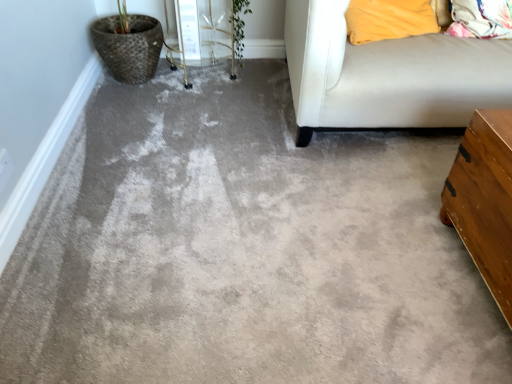
At what (x,y) coordinates should I click in order to perform the action: click on soft yellow pillow at upper right. Please return your answer as a coordinate pair (x, y). The image size is (512, 384). Looking at the image, I should click on (389, 19).

Describe the element at coordinates (389, 19) in the screenshot. I see `soft yellow pillow at upper right` at that location.

Locate an element on the screen. soft yellow pillow at upper right is located at coordinates (389, 19).